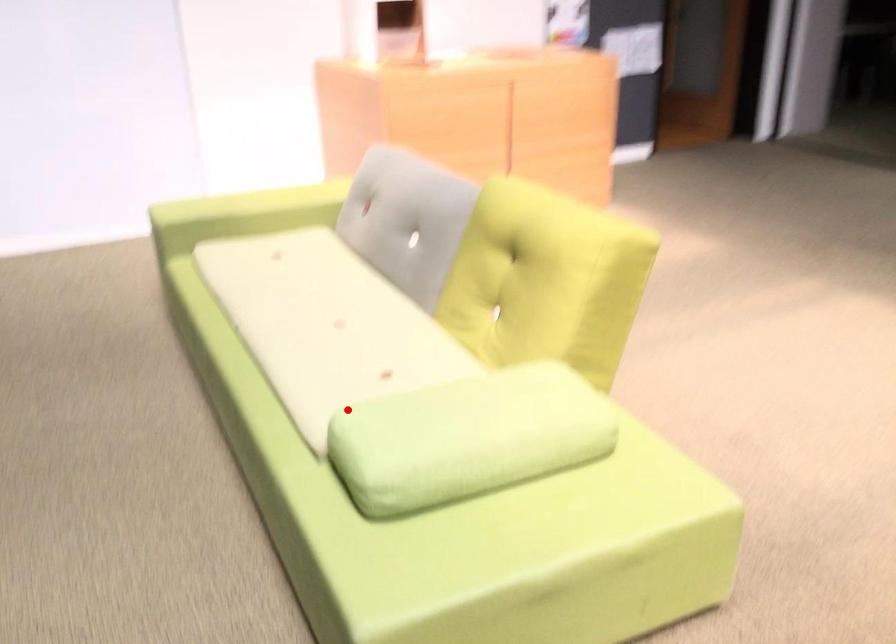
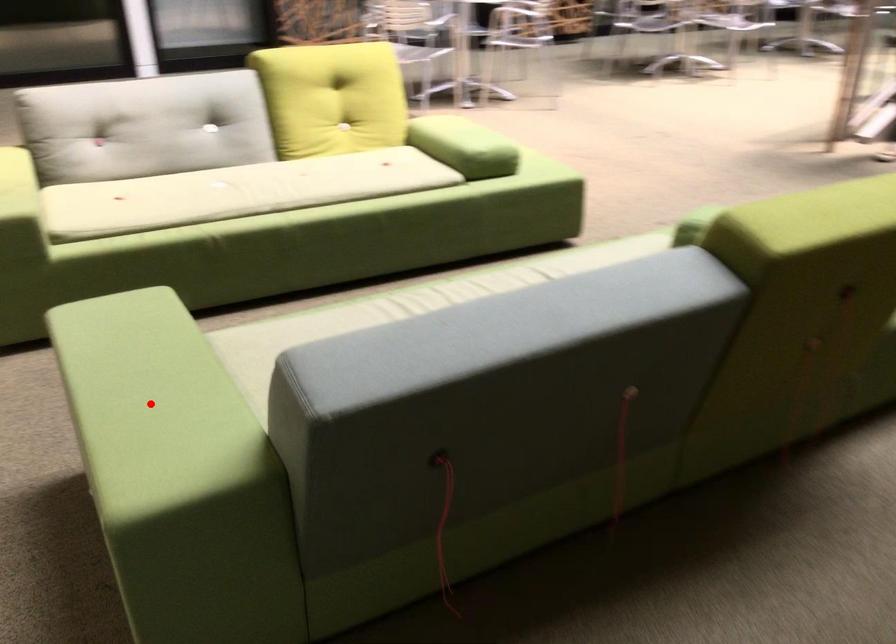
I am providing you with two images of the same scene from different viewpoints. A red point is marked on the first image and another point is marked on the second image. Are the points marked in image1 and image2 representing the same 3D position?

No